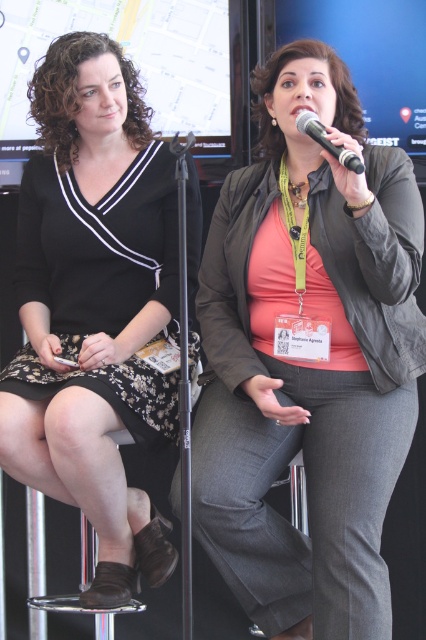
Question: Is orange matte shirt at center to the right of black plastic microphone at upper center from the viewer's perspective?

Choices:
 (A) yes
 (B) no

Answer: (B)

Question: Does orange matte shirt at center have a smaller size compared to black floral dress at left?

Choices:
 (A) no
 (B) yes

Answer: (A)

Question: Among these objects, which one is farthest from the camera?

Choices:
 (A) black floral dress at left
 (B) orange matte shirt at center
 (C) black plastic microphone at upper center

Answer: (A)

Question: Which point is farther to the camera?

Choices:
 (A) (348, 161)
 (B) (279, 68)

Answer: (B)

Question: Among these points, which one is farthest from the camera?

Choices:
 (A) (359, 164)
 (B) (362, 557)

Answer: (B)

Question: Is black floral dress at left positioned behind black plastic microphone at upper center?

Choices:
 (A) yes
 (B) no

Answer: (A)